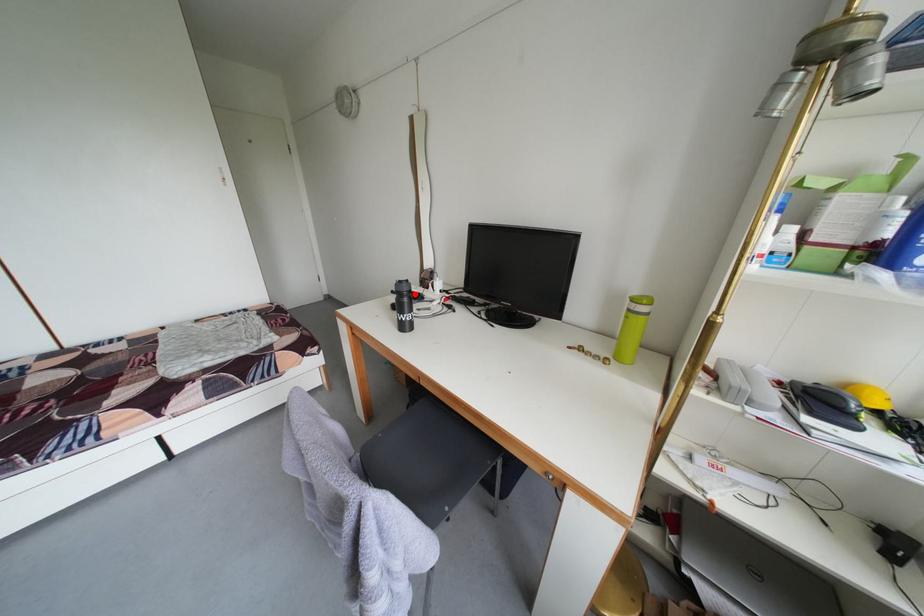
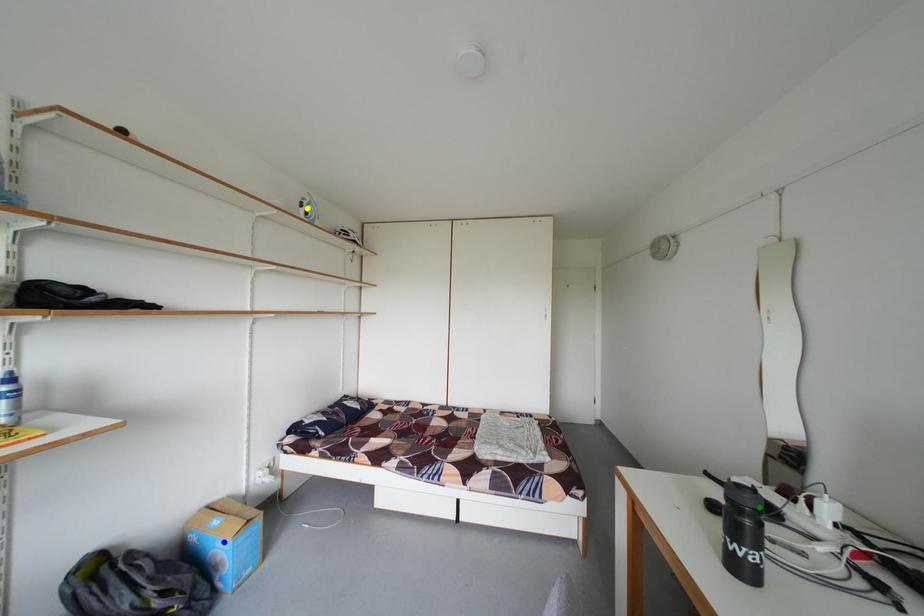
Question: I am providing you with two images of the same scene from different viewpoints. A red point is marked on the first image. You are given multiple points on the second image. In image 2, which mark is for the same physical point as the one in image 1?

Choices:
 (A) green point
 (B) blue point
 (C) yellow point

Answer: (A)